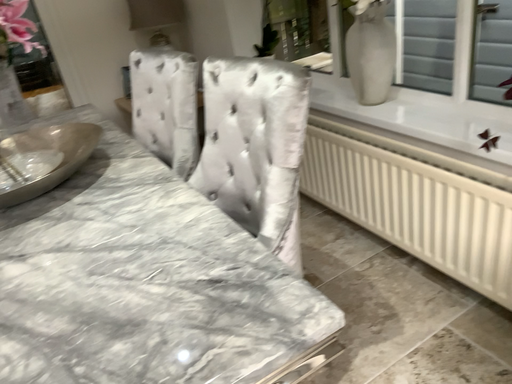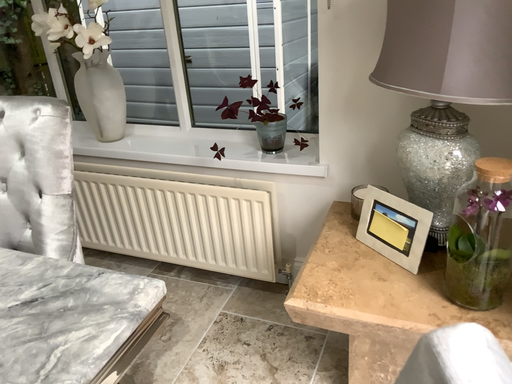
Question: How did the camera likely rotate when shooting the video?

Choices:
 (A) rotated right
 (B) rotated left

Answer: (A)